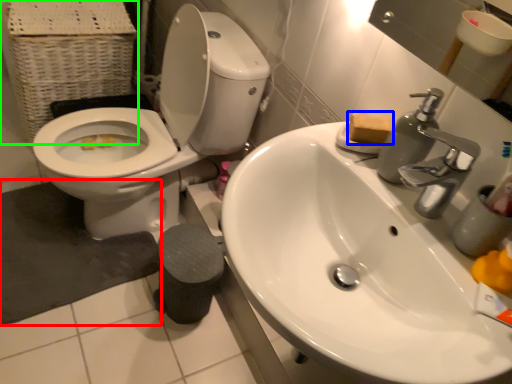
Question: Estimate the real-world distances between objects in this image. Which object is closer to bath mat (highlighted by a red box), soap (highlighted by a blue box) or basket (highlighted by a green box)?

Choices:
 (A) soap
 (B) basket

Answer: (B)